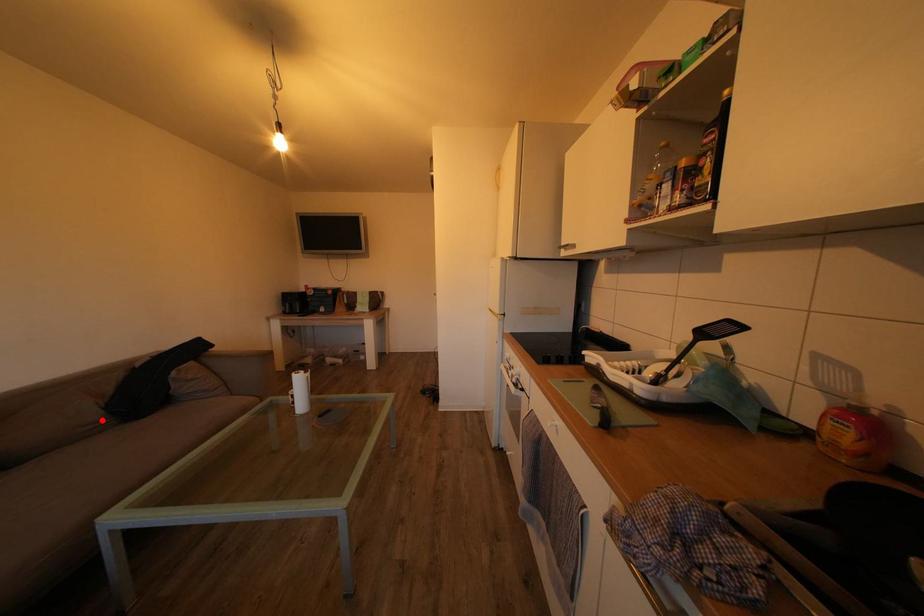
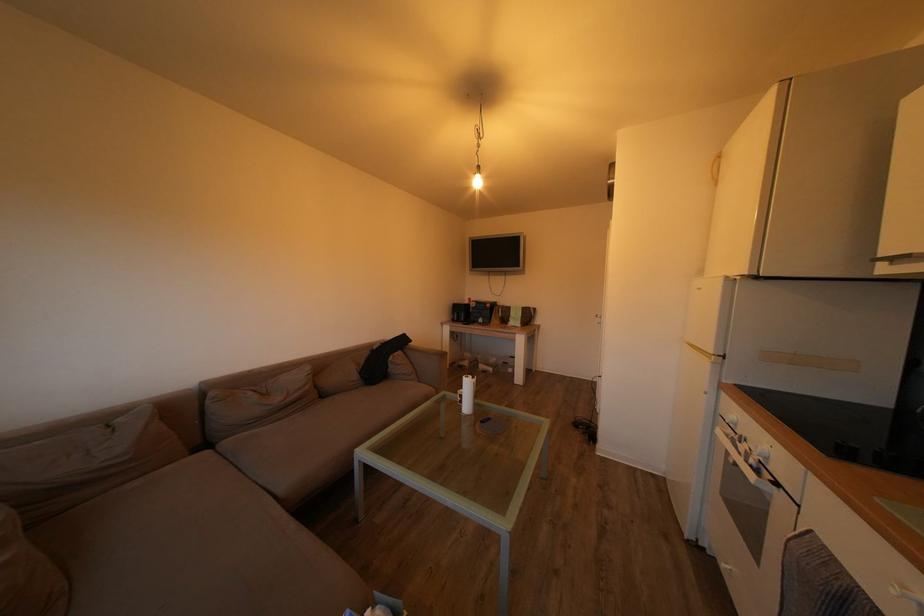
Locate, in the second image, the point that corresponds to the highlighted location in the first image.

(362, 382)